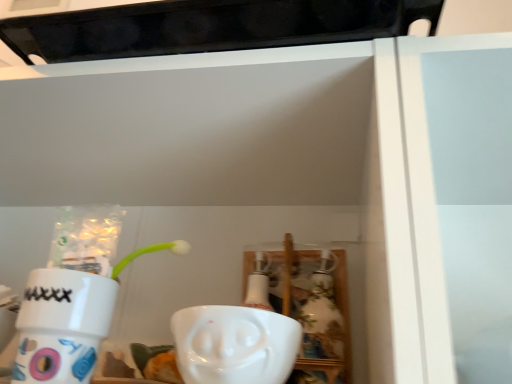
What do you see at coordinates (62, 325) in the screenshot? I see `matte white mug at left` at bounding box center [62, 325].

The width and height of the screenshot is (512, 384). What are the coordinates of `matte white mug at left` in the screenshot? It's located at (62, 325).

Identify the location of matte white mug at left. The image size is (512, 384). (62, 325).